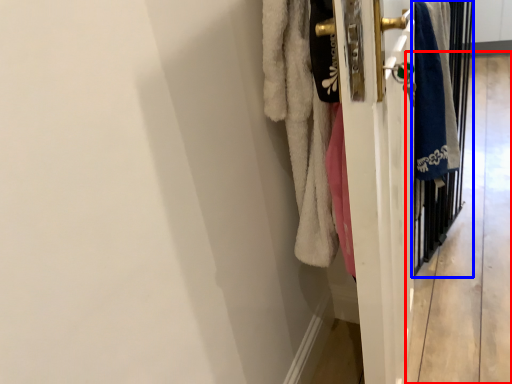
Question: Which object appears closest to the camera in this image, corridor (highlighted by a red box) or screen door (highlighted by a blue box)?

Choices:
 (A) corridor
 (B) screen door

Answer: (B)